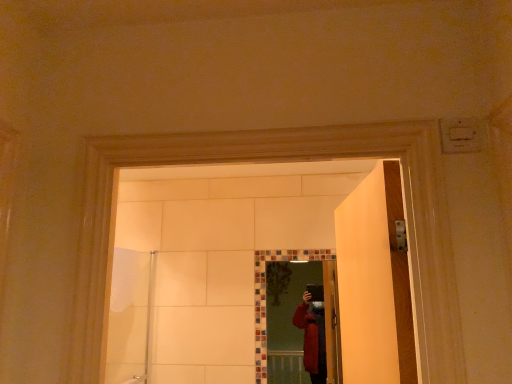
Question: Is white fabric shower door at left positioned before multicolored mosaic mirror at center?

Choices:
 (A) yes
 (B) no

Answer: (A)

Question: Does white fabric shower door at left have a greater height compared to multicolored mosaic mirror at center?

Choices:
 (A) no
 (B) yes

Answer: (B)

Question: Is white fabric shower door at left oriented towards multicolored mosaic mirror at center?

Choices:
 (A) yes
 (B) no

Answer: (A)

Question: Considering the relative sizes of white fabric shower door at left and multicolored mosaic mirror at center in the image provided, is white fabric shower door at left wider than multicolored mosaic mirror at center?

Choices:
 (A) yes
 (B) no

Answer: (A)

Question: Is white fabric shower door at left turned away from multicolored mosaic mirror at center?

Choices:
 (A) no
 (B) yes

Answer: (A)

Question: From the image's perspective, is white fabric shower door at left below multicolored mosaic mirror at center?

Choices:
 (A) yes
 (B) no

Answer: (B)

Question: Is multicolored mosaic mirror at center oriented away from white fabric shower door at left?

Choices:
 (A) no
 (B) yes

Answer: (A)

Question: Is multicolored mosaic mirror at center to the right of white fabric shower door at left from the viewer's perspective?

Choices:
 (A) yes
 (B) no

Answer: (A)

Question: Is multicolored mosaic mirror at center to the left of white fabric shower door at left from the viewer's perspective?

Choices:
 (A) yes
 (B) no

Answer: (B)

Question: Considering the relative sizes of multicolored mosaic mirror at center and white fabric shower door at left in the image provided, is multicolored mosaic mirror at center smaller than white fabric shower door at left?

Choices:
 (A) yes
 (B) no

Answer: (A)

Question: Does multicolored mosaic mirror at center come behind white fabric shower door at left?

Choices:
 (A) no
 (B) yes

Answer: (B)

Question: Is multicolored mosaic mirror at center beside white fabric shower door at left?

Choices:
 (A) no
 (B) yes

Answer: (A)

Question: Would you say multicolored mosaic mirror at center is to the left or to the right of white fabric shower door at left in the picture?

Choices:
 (A) right
 (B) left

Answer: (A)